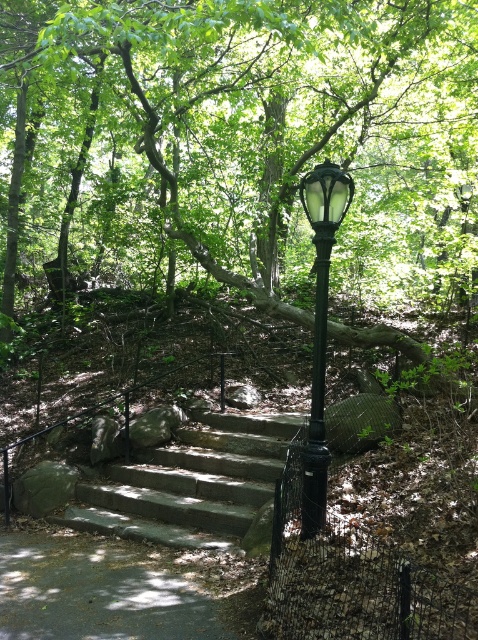
Identify the location of black glass lamp post at center. (319, 328).

Can you confirm if black glass lamp post at center is shorter than black metal pole at center?

No.

Describe the element at coordinates (319, 328) in the screenshot. I see `black glass lamp post at center` at that location.

You are a GUI agent. You are given a task and a screenshot of the screen. Output one action in this format:
    pyautogui.click(x=<x>, y=<y>)
    Task: Click on the black glass lamp post at center
    This screenshot has width=478, height=640.
    Given the screenshot: What is the action you would take?
    pyautogui.click(x=319, y=328)

Between gray stone stairs at center and black metal pole at center, which one has less height?

gray stone stairs at center

Does gray stone stairs at center have a lesser width compared to black metal pole at center?

In fact, gray stone stairs at center might be wider than black metal pole at center.

Image resolution: width=478 pixels, height=640 pixels. Describe the element at coordinates (189, 483) in the screenshot. I see `gray stone stairs at center` at that location.

Where is `gray stone stairs at center`? gray stone stairs at center is located at coordinates (189, 483).

Between point (231, 544) and point (349, 198), which one is positioned in front?

Positioned in front is point (349, 198).

In the scene shown: Which is above, gray stone stairs at center or black glass lamp post at center?

Positioned higher is black glass lamp post at center.

Locate an element on the screen. Image resolution: width=478 pixels, height=640 pixels. gray stone stairs at center is located at coordinates (189, 483).